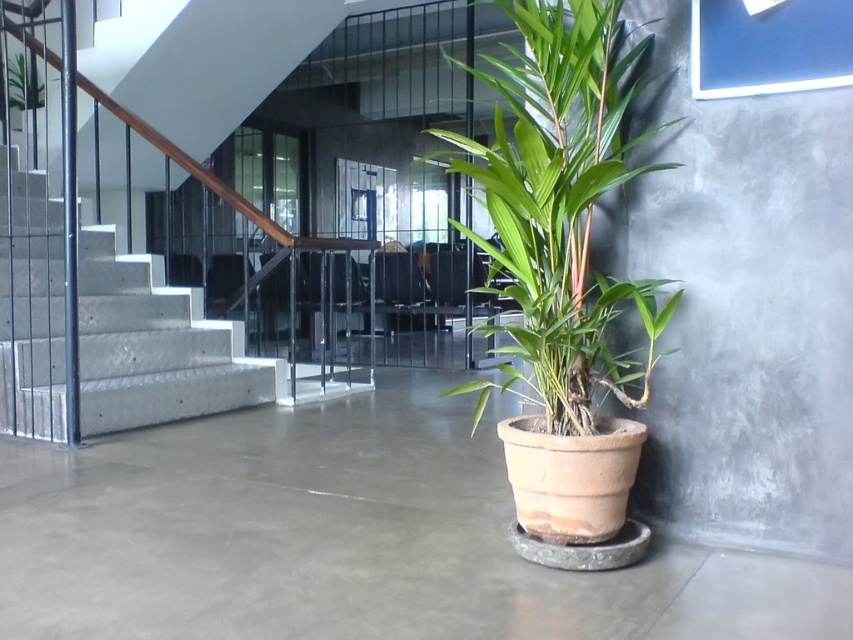
Question: Which object is the closest to the concrete/stamped concrete stairs at left?

Choices:
 (A) green leafy plant at upper left
 (B) green matte plant at center
 (C) smooth concrete floor at center

Answer: (C)

Question: Which of the following is the closest to the observer?

Choices:
 (A) (280, 508)
 (B) (527, 97)

Answer: (B)

Question: Is concrete/stamped concrete stairs at left smaller than green leafy plant at upper left?

Choices:
 (A) yes
 (B) no

Answer: (B)

Question: Where is smooth concrete floor at center located in relation to green matte plant at center in the image?

Choices:
 (A) left
 (B) right

Answer: (A)

Question: Does smooth concrete floor at center have a lesser width compared to green leafy plant at upper left?

Choices:
 (A) no
 (B) yes

Answer: (A)

Question: Based on their relative distances, which object is farther from the smooth concrete floor at center?

Choices:
 (A) green matte plant at center
 (B) green leafy plant at upper left
 (C) concrete/stamped concrete stairs at left

Answer: (B)